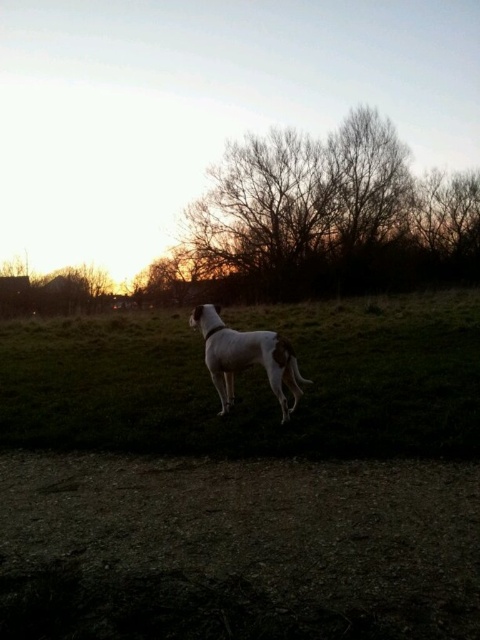
In order to click on green grass at center in this screenshot , I will do `click(251, 381)`.

Is point (451, 324) closer to camera compared to point (269, 289)?

Yes.

Locate an element on the screen. green grass at center is located at coordinates (251, 381).

This screenshot has height=640, width=480. I want to click on bare branches at upper center, so click(x=331, y=216).

Does bare branches at upper center have a greater height compared to white fur dog at center?

Yes, bare branches at upper center is taller than white fur dog at center.

Where is `bare branches at upper center`? This screenshot has height=640, width=480. bare branches at upper center is located at coordinates (331, 216).

Which of these two, green grass at center or white fur dog at center, stands shorter?

With less height is white fur dog at center.

Which is more to the right, green grass at center or white fur dog at center?

green grass at center is more to the right.

What are the coordinates of `green grass at center` in the screenshot? It's located at (251, 381).